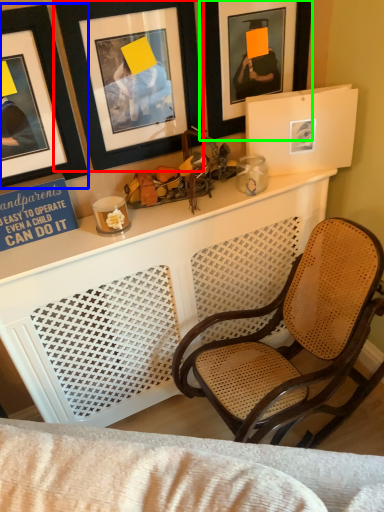
Question: Based on their relative distances, which object is nearer to picture frame (highlighted by a red box)? Choose from picture frame (highlighted by a blue box) and picture frame (highlighted by a green box).

Choices:
 (A) picture frame
 (B) picture frame

Answer: (A)